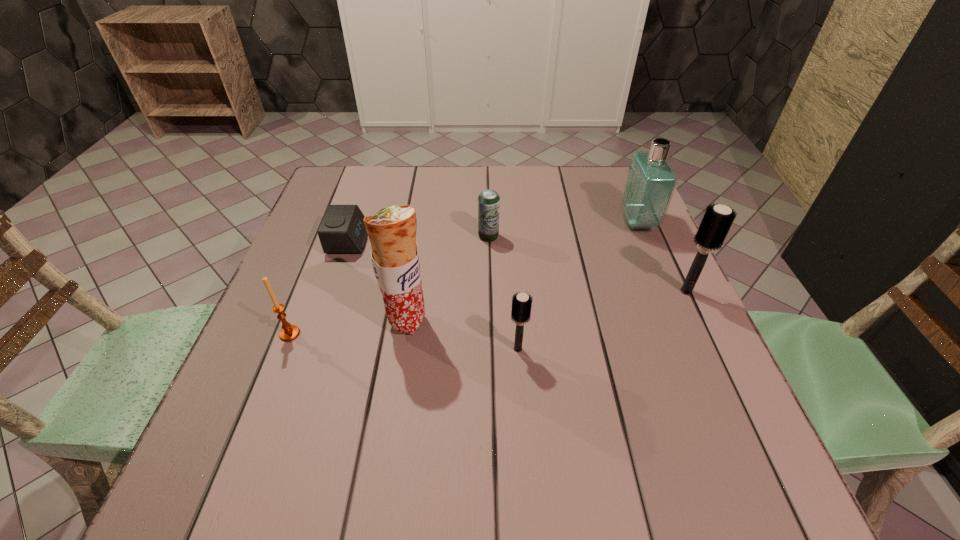
Please point a vacant point for placing a hairbrush on the left. Please provide its 2D coordinates. Your answer should be formatted as a tuple, i.e. [(x, y)], where the tuple contains the x and y coordinates of a point satisfying the conditions above.

[(299, 424)]